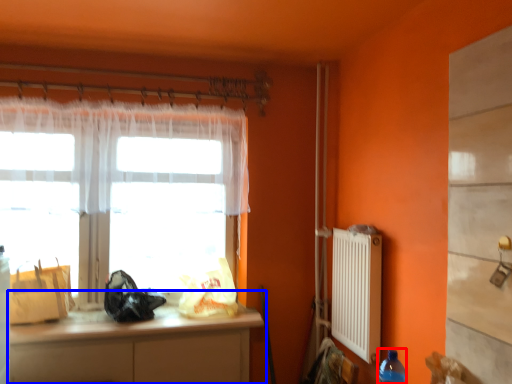
Question: Which point is closer to the camera, bottle (highlighted by a red box) or cabinetry (highlighted by a blue box)?

Choices:
 (A) bottle
 (B) cabinetry

Answer: (A)